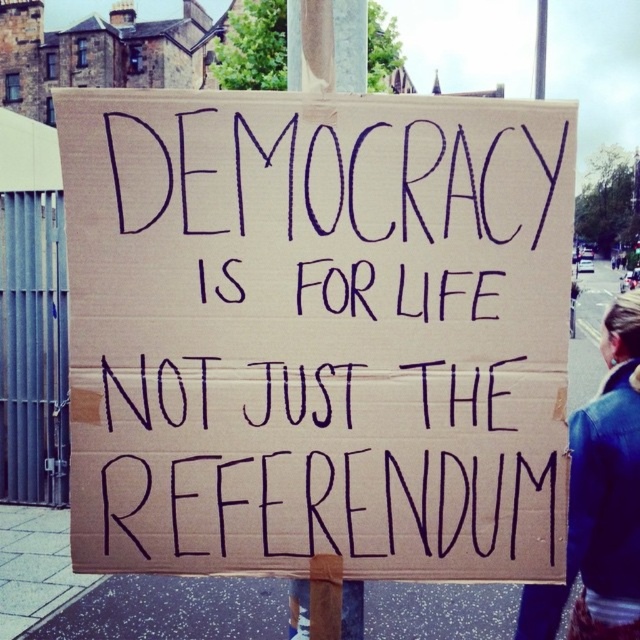
Question: Which of these objects is positioned closest to the brown cardboard sign at center?

Choices:
 (A) wooden post at center
 (B) leather jacket at lower right

Answer: (A)

Question: Where is brown cardboard sign at center located in relation to wooden post at center in the image?

Choices:
 (A) below
 (B) above

Answer: (A)

Question: Based on their relative distances, which object is farther from the wooden post at center?

Choices:
 (A) leather jacket at lower right
 (B) brown cardboard sign at center

Answer: (A)

Question: Is brown cardboard sign at center below wooden post at center?

Choices:
 (A) yes
 (B) no

Answer: (A)

Question: Is brown cardboard sign at center above wooden post at center?

Choices:
 (A) yes
 (B) no

Answer: (B)

Question: Which object is positioned farthest from the brown cardboard sign at center?

Choices:
 (A) leather jacket at lower right
 (B) wooden post at center

Answer: (A)